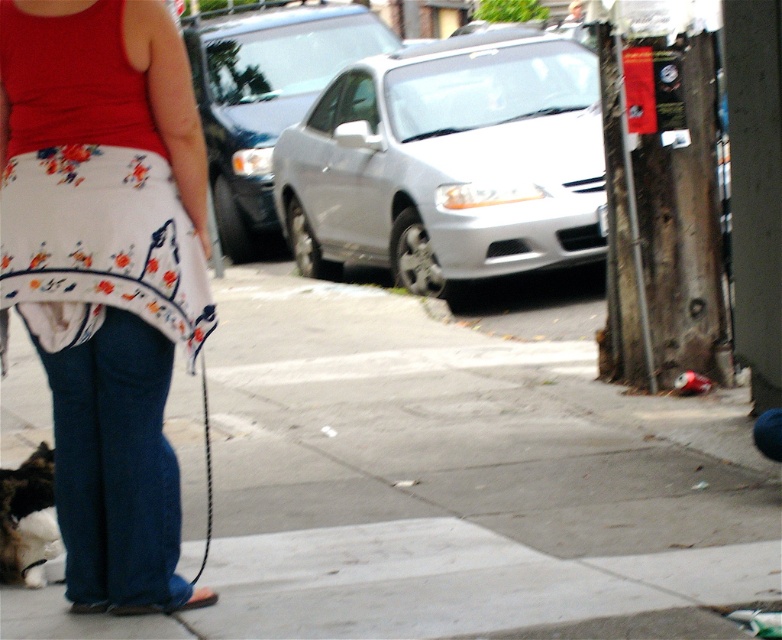
Between floral-patterned apron at center and fluffy fur cat at lower left, which one has more height?

floral-patterned apron at center is taller.

Looking at this image, who is positioned more to the left, floral-patterned apron at center or fluffy fur cat at lower left?

fluffy fur cat at lower left is more to the left.

The width and height of the screenshot is (782, 640). Find the location of `floral-patterned apron at center`. floral-patterned apron at center is located at coordinates (106, 272).

Where is `floral-patterned apron at center`? floral-patterned apron at center is located at coordinates (106, 272).

Which of these two, gray concrete sidewalk at center or black rope leash at lower left, stands shorter?

Standing shorter between the two is black rope leash at lower left.

Which is behind, point (612, 400) or point (203, 424)?

Positioned behind is point (612, 400).

The width and height of the screenshot is (782, 640). In order to click on gray concrete sidewalk at center in this screenshot , I will do `click(450, 484)`.

Which is more to the left, gray concrete sidewalk at center or floral-patterned apron at center?

From the viewer's perspective, floral-patterned apron at center appears more on the left side.

Does point (626, 548) come farther from viewer compared to point (185, 72)?

Yes.

Who is more forward, (x=421, y=570) or (x=127, y=433)?

Point (x=127, y=433) is in front.

I want to click on gray concrete sidewalk at center, so (x=450, y=484).